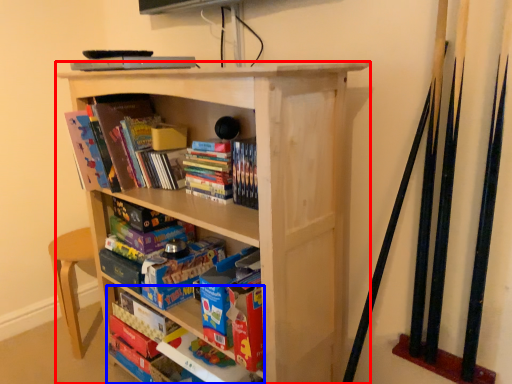
Question: Which object is further to the camera taking this photo, bookcase (highlighted by a red box) or book (highlighted by a blue box)?

Choices:
 (A) bookcase
 (B) book

Answer: (B)